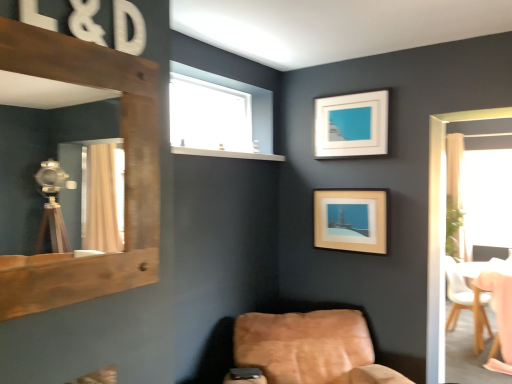
Question: Would you say transparent glass window at upper center is inside or outside rustic wood mirror at left?

Choices:
 (A) outside
 (B) inside

Answer: (A)

Question: In terms of width, does transparent glass window at upper center look wider or thinner when compared to rustic wood mirror at left?

Choices:
 (A) thin
 (B) wide

Answer: (B)

Question: Estimate the real-world distances between objects in this image. Which object is farther from the beige fabric curtain at right?

Choices:
 (A) wooden picture frame at center, the 2th picture frame viewed from the top
 (B) white matte picture frame at upper center, placed as the 1th picture frame when sorted from top to bottom
 (C) transparent glass window at upper center
 (D) leather at lower right, which is the third chair in back-to-front order
 (E) wooden chair at lower right, which is the 1th chair in right-to-left order

Answer: (C)

Question: Which object is the farthest from the rustic wood mirror at left?

Choices:
 (A) white matte picture frame at upper center, which ranks as the second picture frame in bottom-to-top order
 (B) leather at lower right, marked as the 1th chair in a left-to-right arrangement
 (C) beige fabric curtain at right
 (D) wooden picture frame at center, the 2th picture frame viewed from the top
 (E) transparent glass window at upper center

Answer: (C)